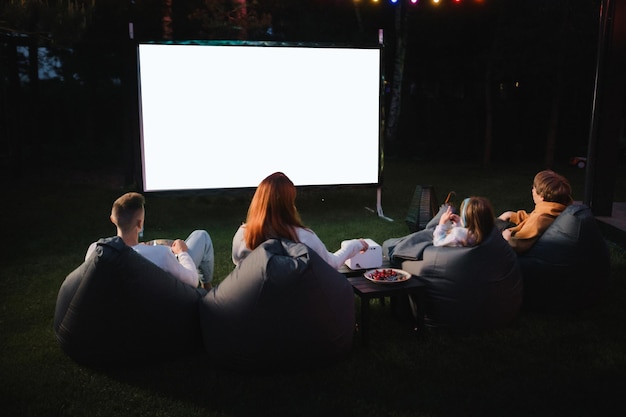
Where is `number of bean bags in the photo`? The image size is (626, 417). number of bean bags in the photo is located at coordinates (126, 320), (260, 300), (471, 281), (568, 270).